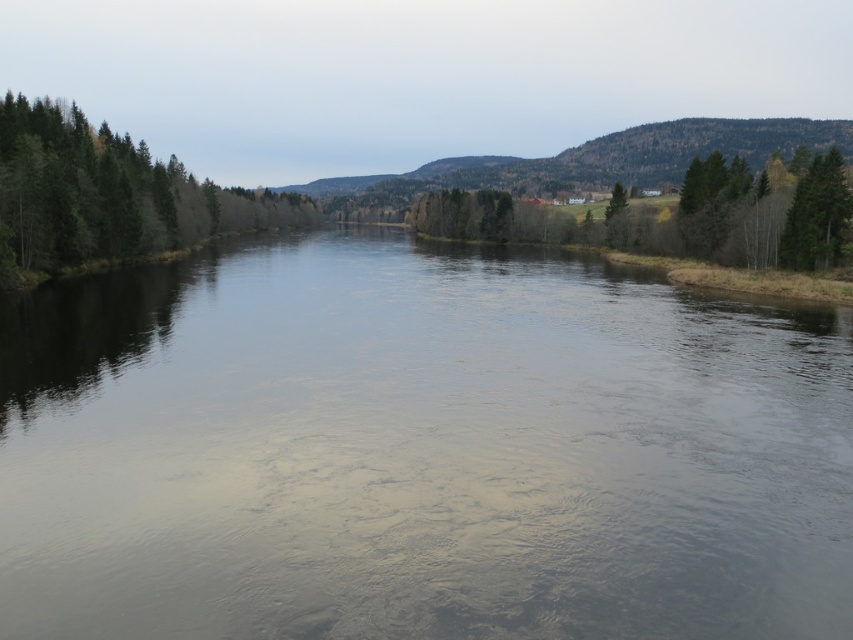
You are standing on a bridge overlooking the smooth water at center and the green matte trees at left. Which object is closer to you based on their positions in the scene?

The smooth water at center is closer to you because it is located below the green matte trees at left, indicating it is positioned lower in the visual plane.

You are standing at point (838, 156) and want to walk to point (212, 225). Based on the scene description, will you be moving towards the river or away from it?

Since point (212, 225) is behind point (838, 156), moving from (838, 156) to (212, 225) means you are moving towards the river.

You are a small boat operator who needs to navigate through the river. The boat is 5 meters long. You see the smooth water at center and the green matte trees at left. Can your boat pass between them without touching the trees?

The smooth water at center and green matte trees at left are 50.91 meters apart from each other. Since the boat is only 5 meters long, there is ample space for it to pass safely between them without touching the trees.